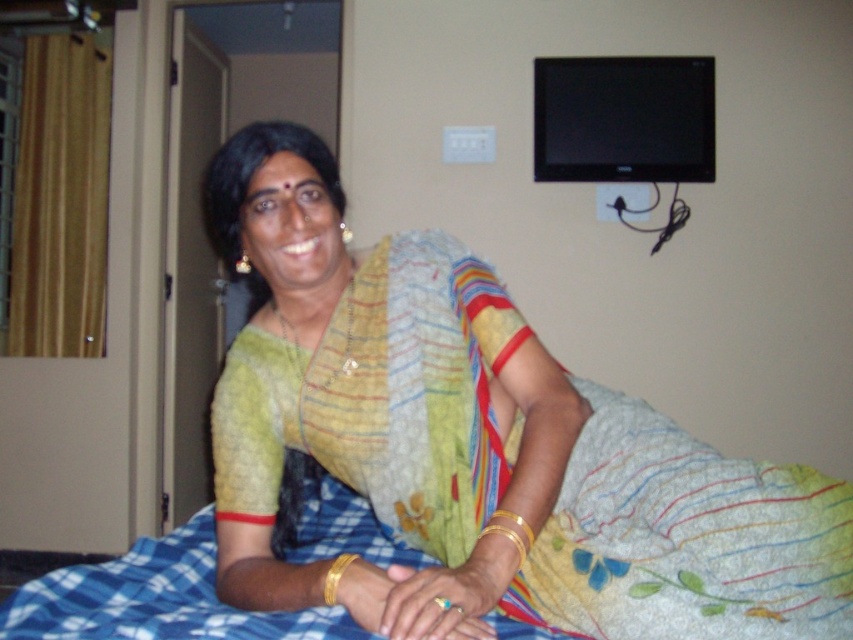
Is matte yellow sari at center above blue checkered blanket at lower left?

Yes.

Does matte yellow sari at center appear on the left side of blue checkered blanket at lower left?

Correct, you'll find matte yellow sari at center to the left of blue checkered blanket at lower left.

You are a GUI agent. You are given a task and a screenshot of the screen. Output one action in this format:
    pyautogui.click(x=<x>, y=<y>)
    Task: Click on the matte yellow sari at center
    
    Given the screenshot: What is the action you would take?
    pyautogui.click(x=358, y=396)